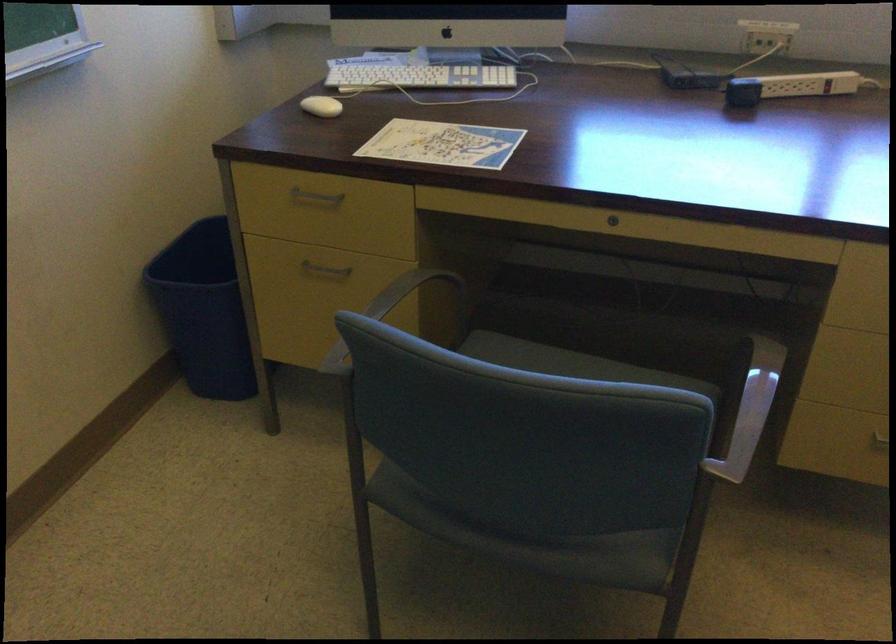
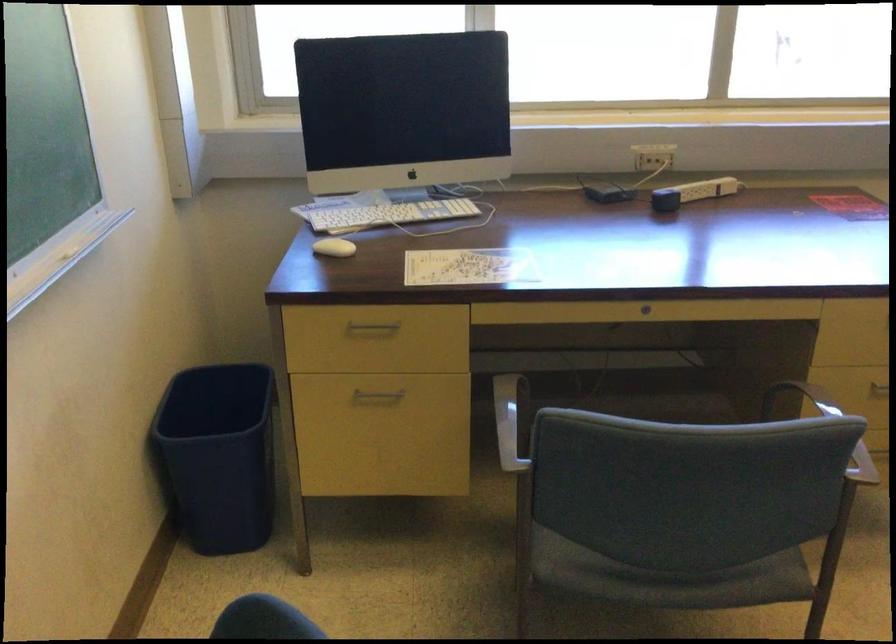
The point at (652, 406) is marked in the first image. Where is the corresponding point in the second image?

(825, 427)